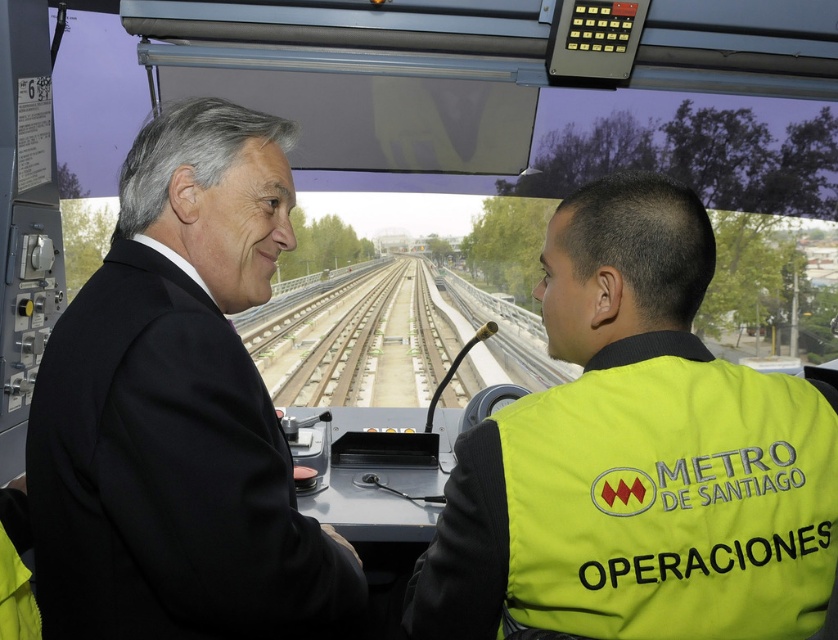
The height and width of the screenshot is (640, 838). Describe the element at coordinates (179, 412) in the screenshot. I see `black suit at left` at that location.

Can you confirm if black suit at left is wider than yellow reflective fabric safety vest at center?

Correct, the width of black suit at left exceeds that of yellow reflective fabric safety vest at center.

What do you see at coordinates (179, 412) in the screenshot? I see `black suit at left` at bounding box center [179, 412].

Where is `black suit at left`? black suit at left is located at coordinates pyautogui.click(x=179, y=412).

Between yellow reflective fabric safety vest at center and green concrete track at center, which one appears on the left side from the viewer's perspective?

green concrete track at center

Looking at this image, who is more forward, (526, 490) or (282, 353)?

Positioned in front is point (526, 490).

Is point (516, 614) more distant than point (478, 369)?

No, (516, 614) is in front of (478, 369).

This screenshot has height=640, width=838. Identify the location of yellow reflective fabric safety vest at center. (670, 497).

Between point (235, 278) and point (303, 372), which one is positioned behind?

Positioned behind is point (303, 372).

Where is `black suit at left`? This screenshot has width=838, height=640. black suit at left is located at coordinates (179, 412).